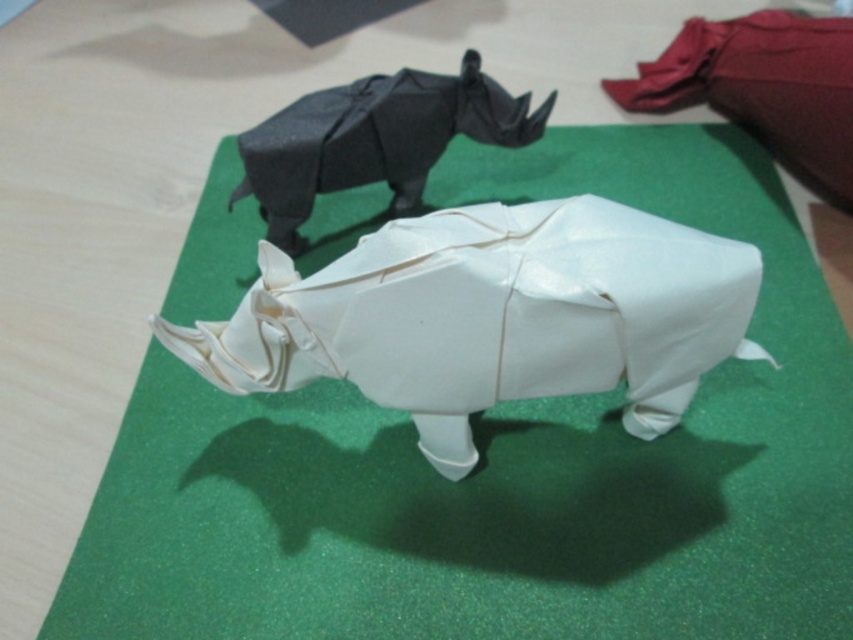
Between white paper rhino at center and black paper rhino at upper center, which one has more height?

white paper rhino at center

Does point (294, 353) come in front of point (363, 141)?

Yes, point (294, 353) is closer to viewer.

Locate an element on the screen. This screenshot has width=853, height=640. white paper rhino at center is located at coordinates (492, 316).